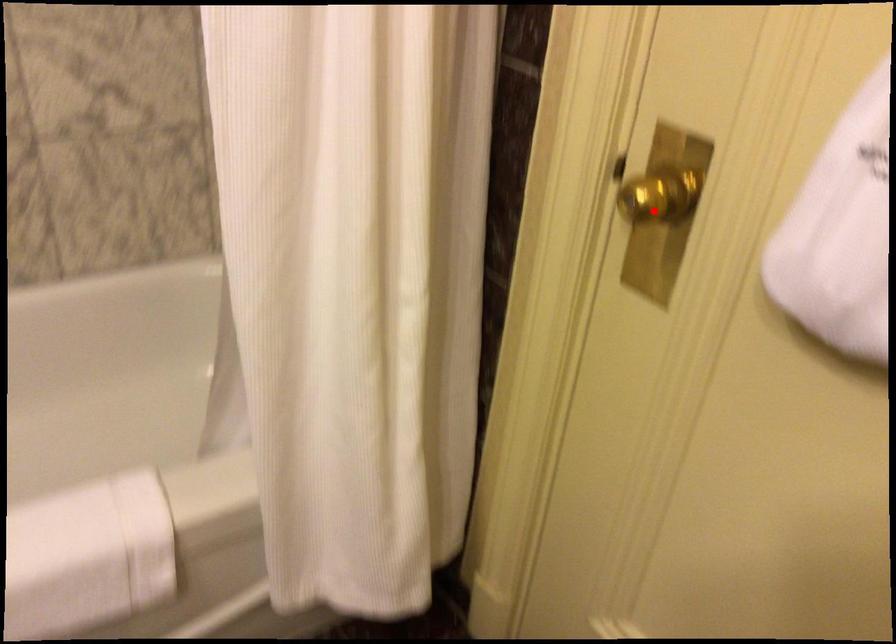
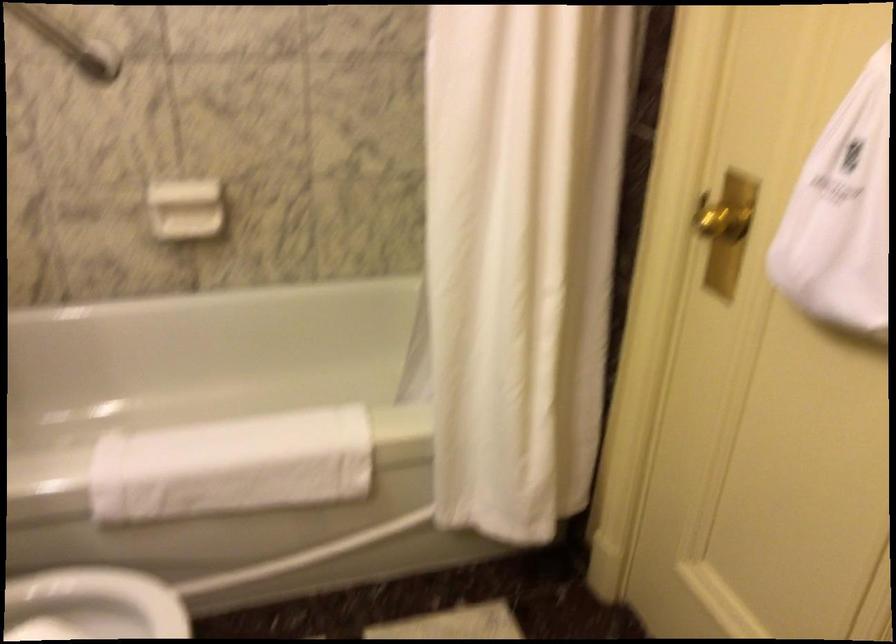
Question: I am providing you with two images of the same scene from different viewpoints. In image1, a red point is highlighted. Considering the same 3D point in image2, which of the following is correct?

Choices:
 (A) It is closer
 (B) It is farther

Answer: (B)